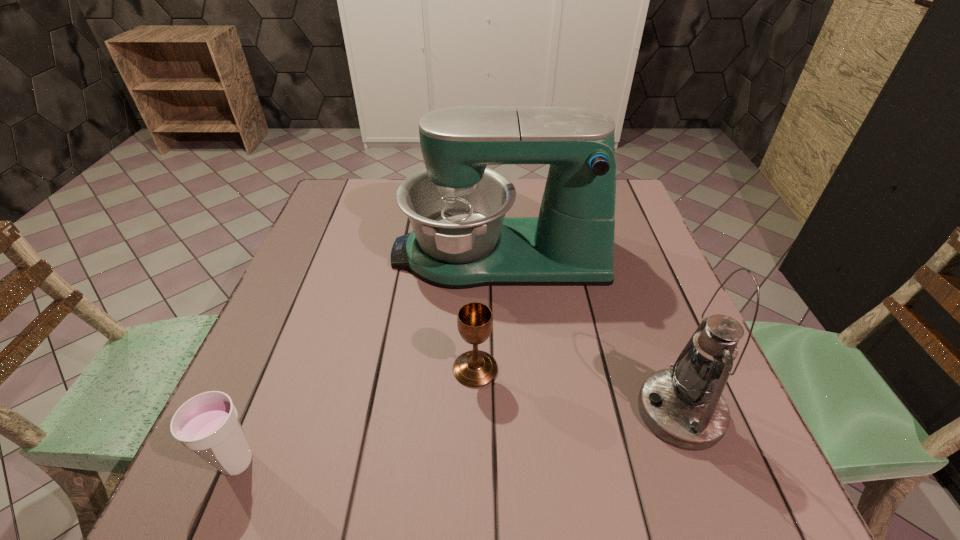
This screenshot has width=960, height=540. What are the coordinates of `object that is at the near edge` in the screenshot? It's located at (208, 424).

Image resolution: width=960 pixels, height=540 pixels. I want to click on object that is at the left edge, so click(208, 424).

Where is `mixer located at the right edge`? mixer located at the right edge is located at coordinates (461, 238).

Identify the location of oil lamp situated at the right edge. The image size is (960, 540). (684, 407).

This screenshot has width=960, height=540. In order to click on object that is at the near left corner in this screenshot , I will do `click(208, 424)`.

Where is `object that is at the far right corner`? This screenshot has width=960, height=540. object that is at the far right corner is located at coordinates (461, 238).

Locate an element on the screen. The width and height of the screenshot is (960, 540). vacant space at the near edge of the desktop is located at coordinates (x=479, y=490).

This screenshot has width=960, height=540. What are the coordinates of `vacant area at the left edge of the desktop` in the screenshot? It's located at (291, 320).

Identify the location of free space at the right edge. This screenshot has height=540, width=960. (646, 306).

The width and height of the screenshot is (960, 540). In order to click on free space at the far left corner of the desktop in this screenshot , I will do `click(342, 191)`.